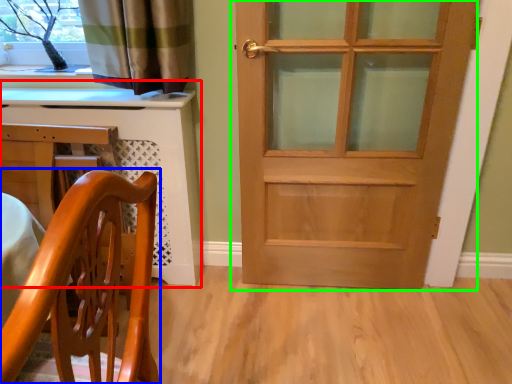
Question: Considering the real-world distances, which object is closest to computer desk (highlighted by a red box)? chair (highlighted by a blue box) or door (highlighted by a green box).

Choices:
 (A) chair
 (B) door

Answer: (B)